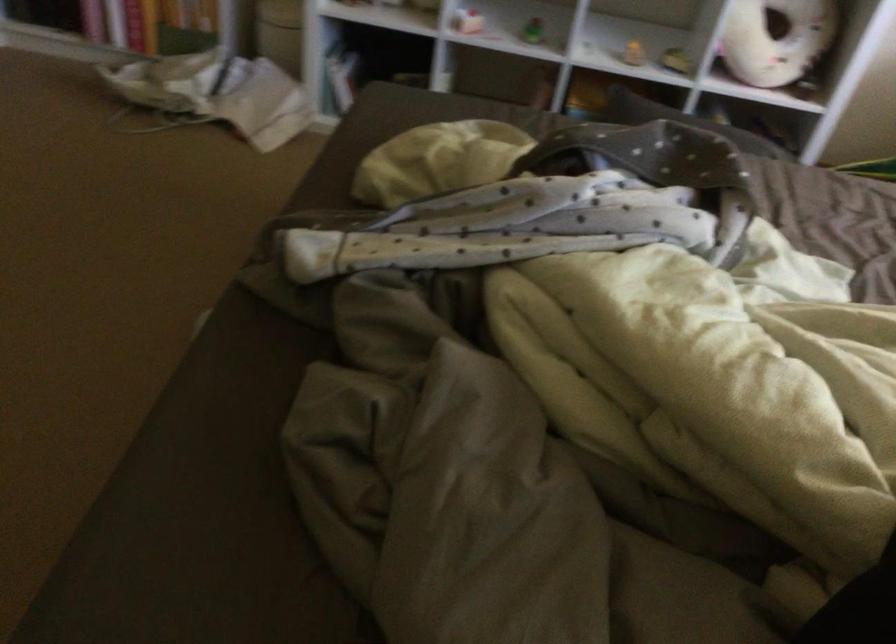
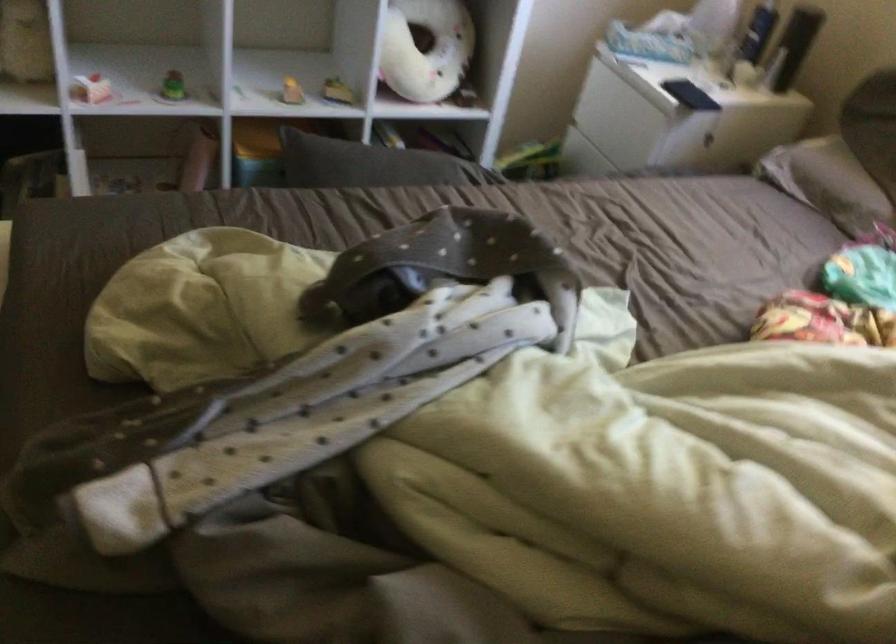
Question: Based on the continuous images, in which direction is the camera rotating? Reply with the corresponding letter.

Choices:
 (A) Left
 (B) Right
 (C) Up
 (D) Down

Answer: (B)